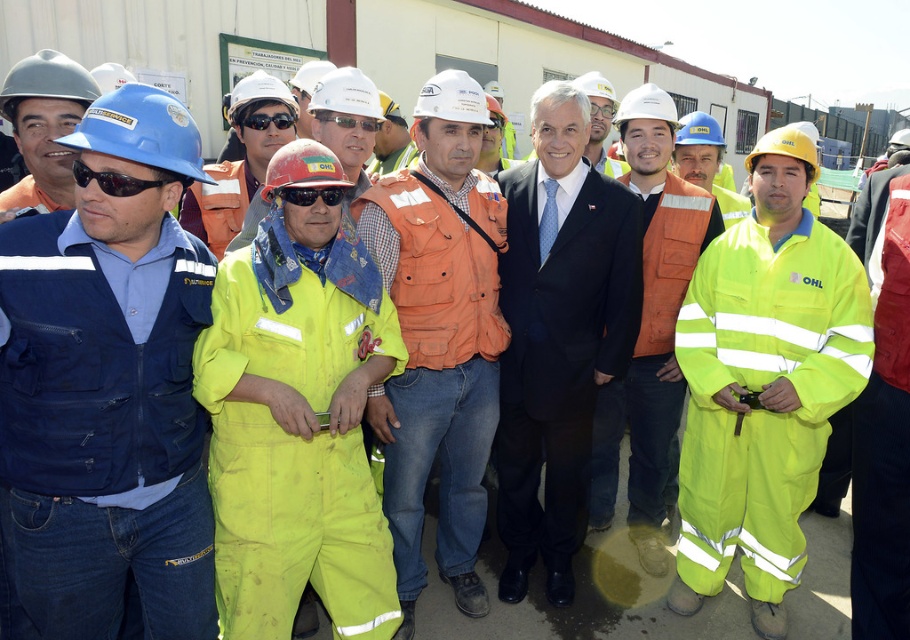
Question: Can you confirm if black plastic sunglasses at center is positioned below black plastic goggles at center?

Choices:
 (A) yes
 (B) no

Answer: (A)

Question: Which point appears farthest from the camera in this image?

Choices:
 (A) (72, 189)
 (B) (39, 316)
 (C) (367, 131)
 (D) (459, 145)

Answer: (C)

Question: Is neon yellow coveralls at center thinner than black reflective goggles at center?

Choices:
 (A) yes
 (B) no

Answer: (B)

Question: Which of the following is the farthest from the observer?

Choices:
 (A) (251, 125)
 (B) (519, 168)
 (C) (290, 195)
 (D) (162, 180)

Answer: (B)

Question: Can you confirm if matte black suit at center is positioned above black plastic sunglasses at center?

Choices:
 (A) yes
 (B) no

Answer: (B)

Question: Which of the following is the closest to the observer?

Choices:
 (A) yellow reflective coveralls at center
 (B) blue fabric jacket at left
 (C) black plastic sunglasses at center

Answer: (B)